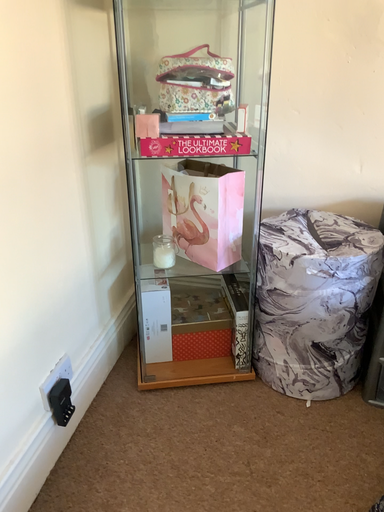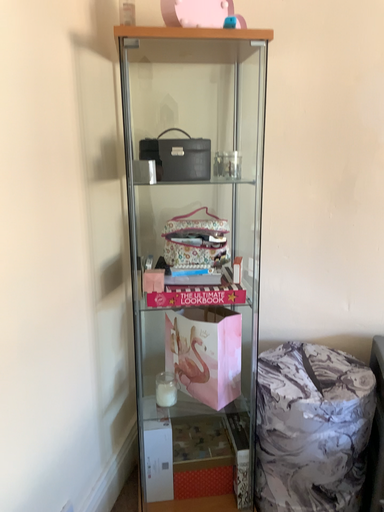
Question: Which way did the camera rotate in the video?

Choices:
 (A) rotated upward
 (B) rotated downward

Answer: (A)